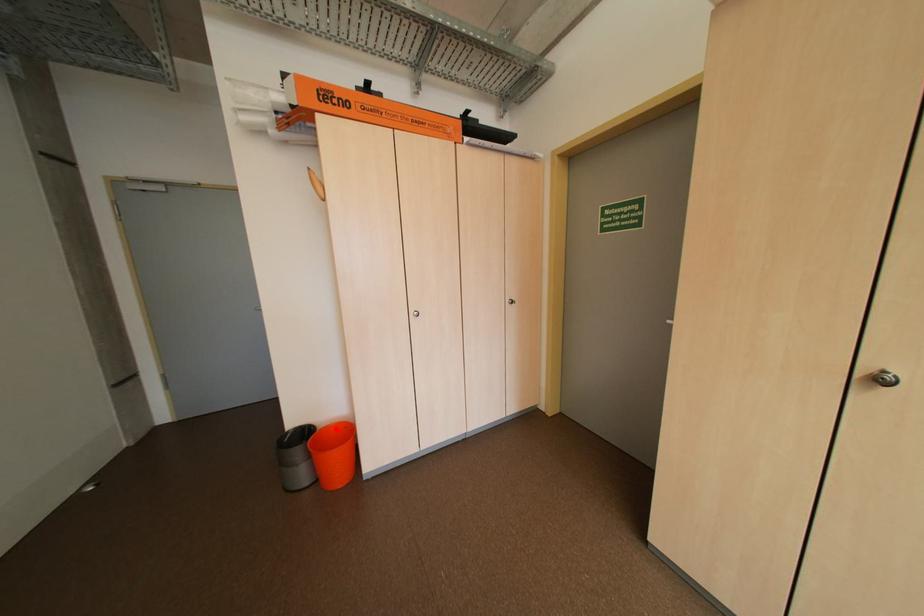
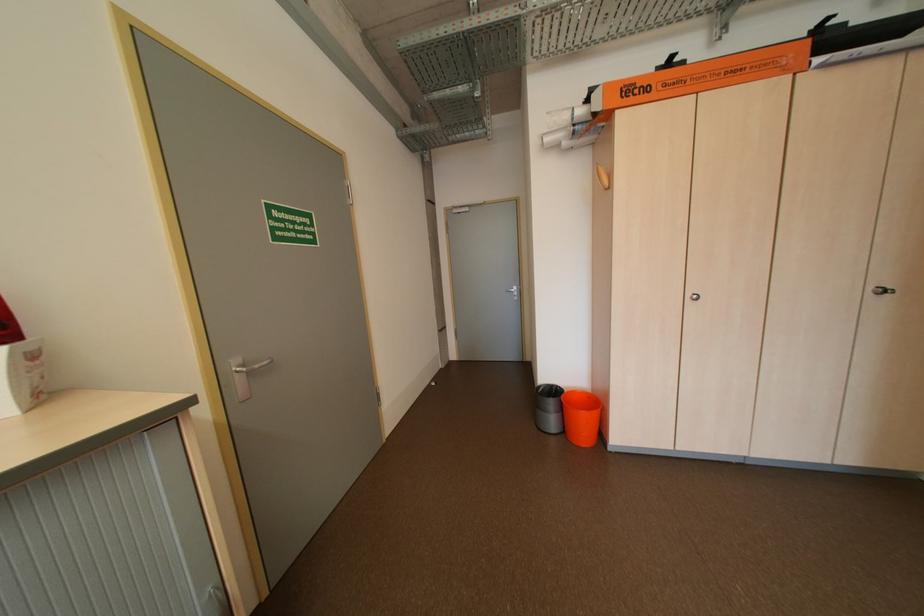
Question: I am providing you with two images of the same scene from different viewpoints. A red point is shown in image1. For the corresponding object point in image2, is it positioned nearer or farther from the camera?

Choices:
 (A) Nearer
 (B) Farther

Answer: (B)